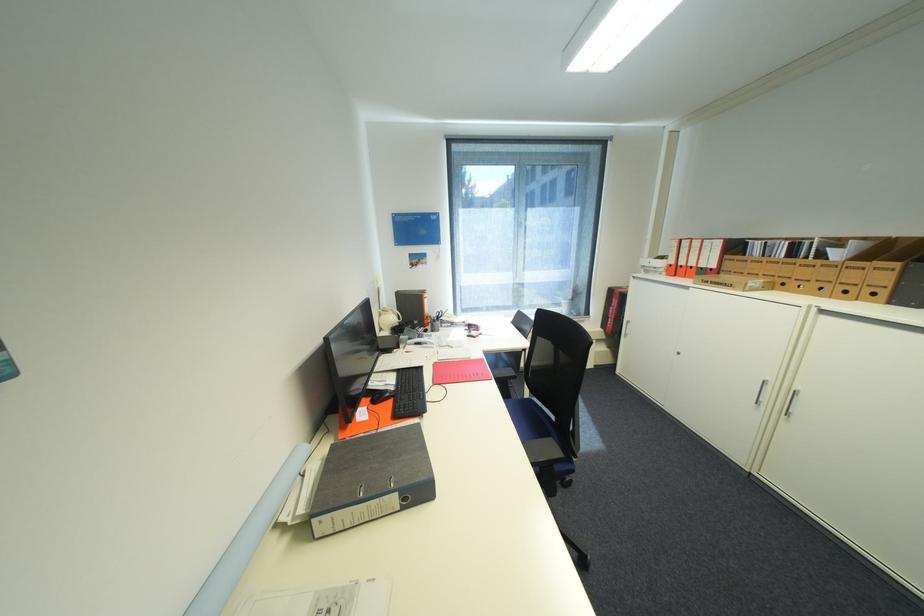
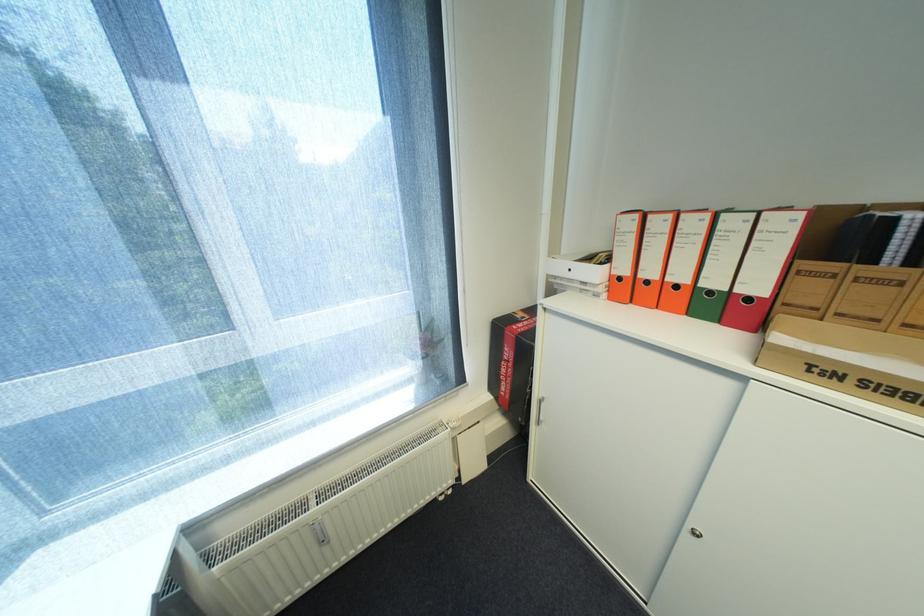
Find the pixel in the second image that matches point (688, 267) in the first image.

(655, 283)